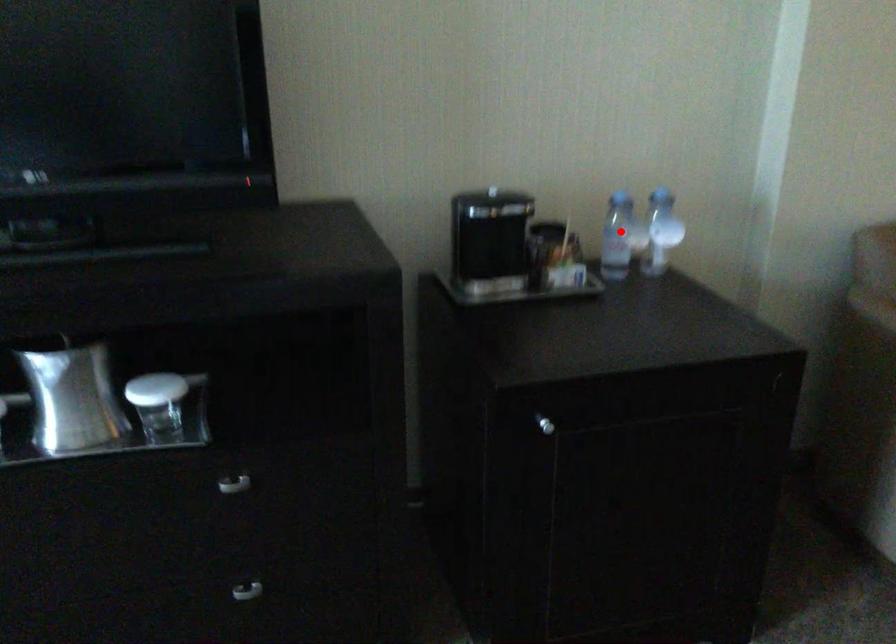
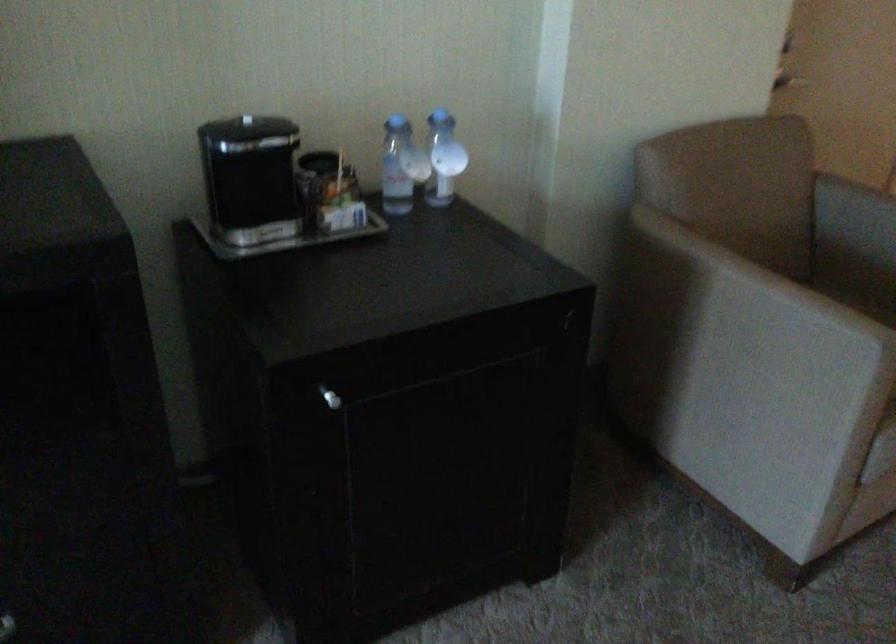
Find the pixel in the second image that matches the highlighted location in the first image.

(401, 166)